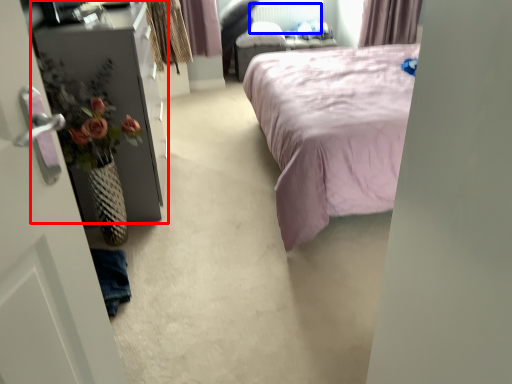
Question: Among these objects, which one is nearest to the camera, furniture (highlighted by a red box) or radiator (highlighted by a blue box)?

Choices:
 (A) furniture
 (B) radiator

Answer: (A)